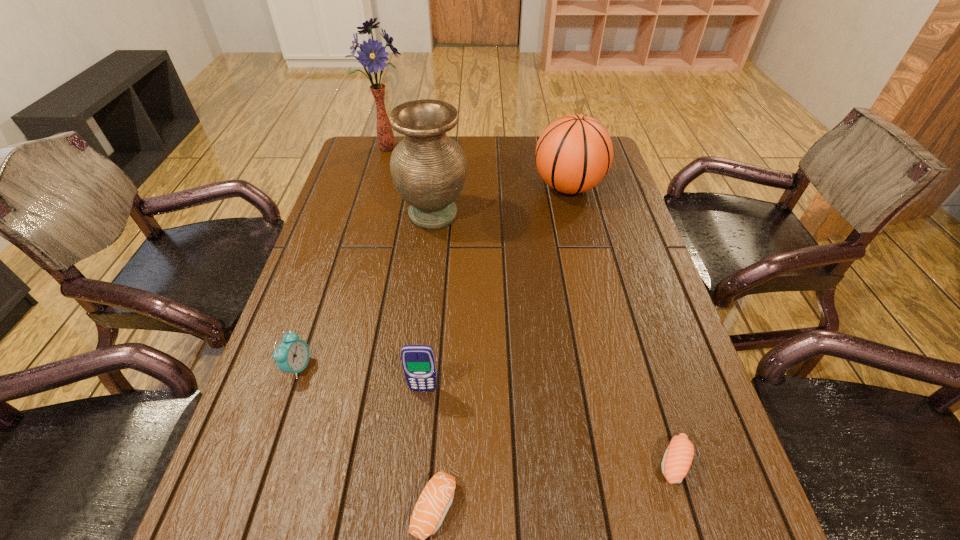
Where is `free space in the image that satisfies the following two spatial constraints: 1. on the front-facing side of the fifth farthest object; 2. on the right side of the right sushi`? The height and width of the screenshot is (540, 960). free space in the image that satisfies the following two spatial constraints: 1. on the front-facing side of the fifth farthest object; 2. on the right side of the right sushi is located at coordinates (416, 462).